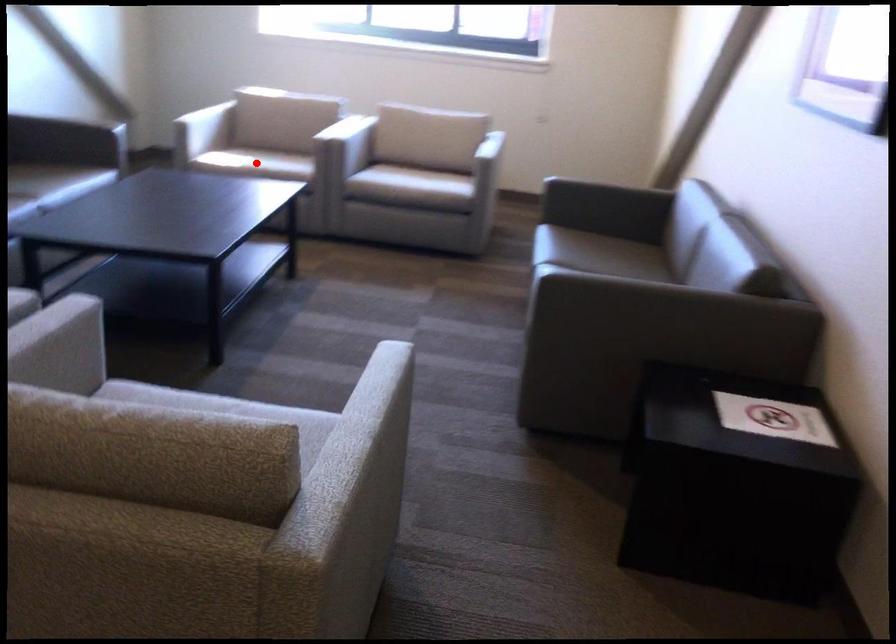
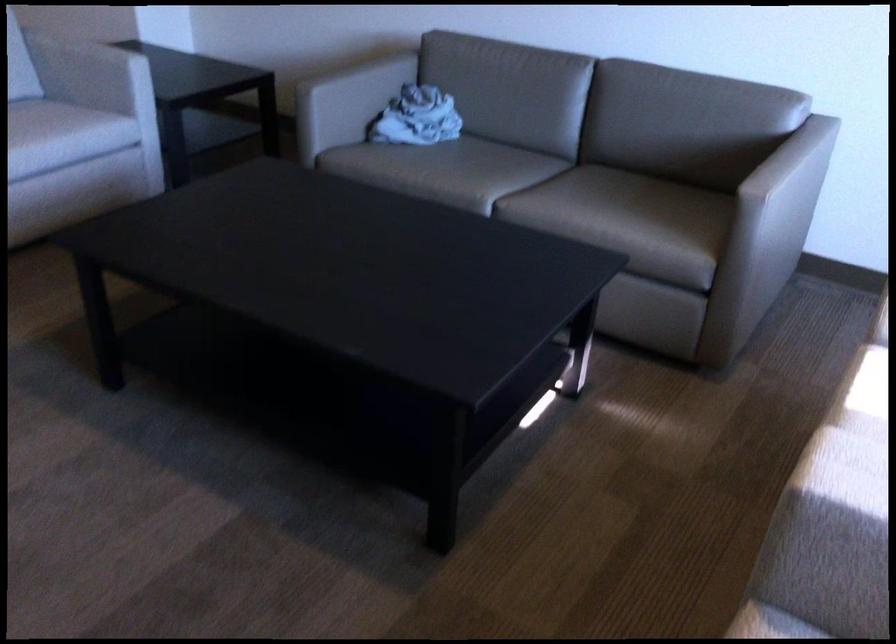
Question: I am providing you with two images of the same scene from different viewpoints. A red point is marked on the first image. Is the red point's position out of view in image 2?

Choices:
 (A) Yes
 (B) No

Answer: (A)